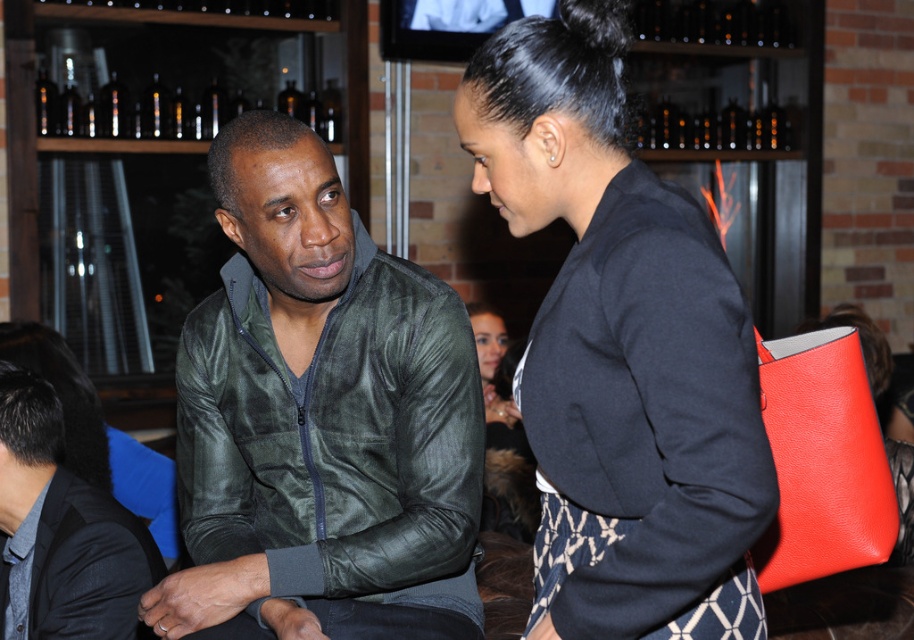
Question: Which point appears farthest from the camera in this image?

Choices:
 (A) [537, 221]
 (B) [503, 397]

Answer: (B)

Question: Which point is farther to the camera?

Choices:
 (A) dark gray textured jacket at lower left
 (B) matte black jacket at center
 (C) black woolen blazer at upper center

Answer: (B)

Question: Observing the image, what is the correct spatial positioning of black woolen blazer at upper center in reference to dark gray textured jacket at lower left?

Choices:
 (A) above
 (B) below

Answer: (A)

Question: Among these objects, which one is nearest to the camera?

Choices:
 (A) dark gray textured jacket at lower left
 (B) matte black jacket at center
 (C) green leather jacket at center
 (D) black woolen blazer at upper center

Answer: (D)

Question: Is dark gray textured jacket at lower left bigger than matte black jacket at center?

Choices:
 (A) no
 (B) yes

Answer: (A)

Question: Is black woolen blazer at upper center thinner than matte black jacket at center?

Choices:
 (A) yes
 (B) no

Answer: (B)